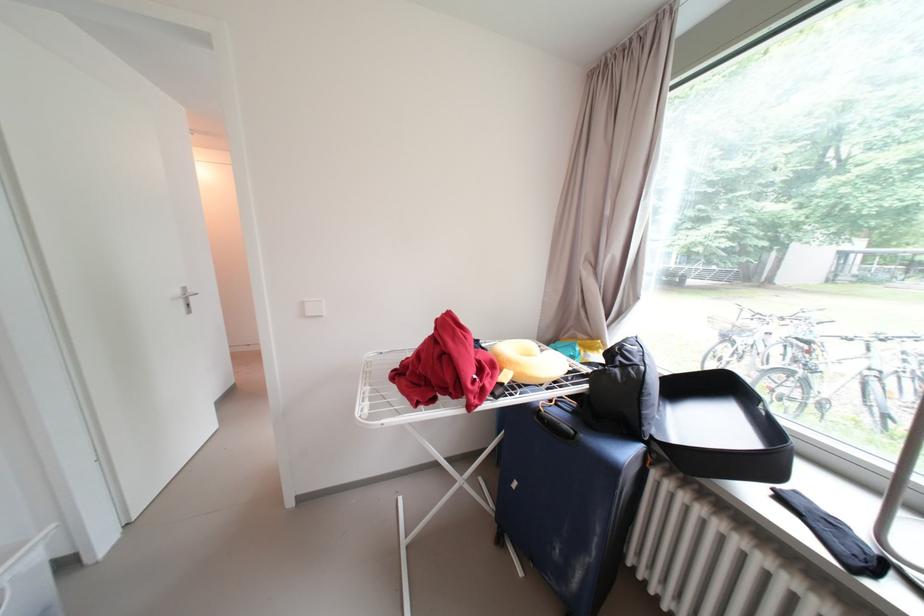
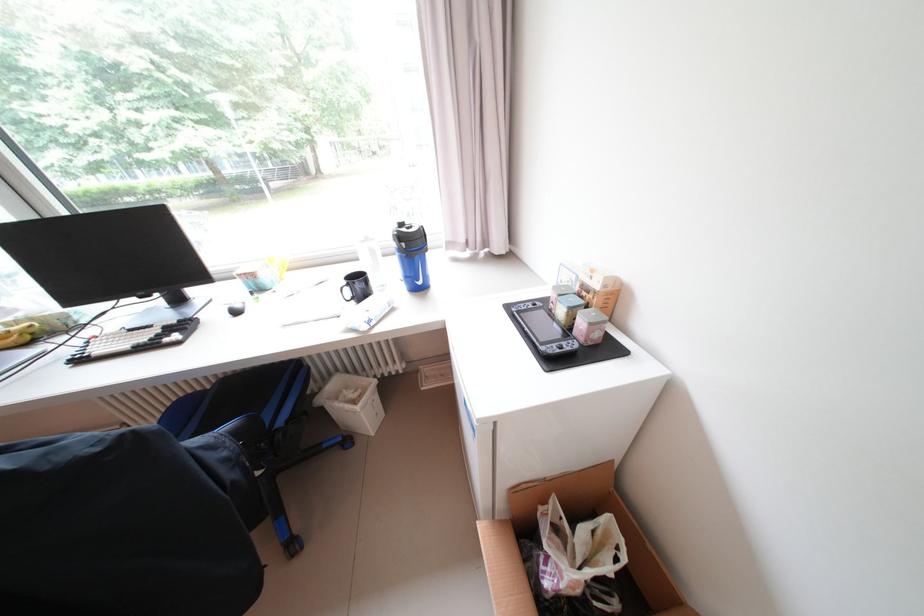
Question: I am providing you with two images of the same scene from different viewpoints. Which of the following objects are not visible in image2?

Choices:
 (A) small green clock
 (B) small cardboard box
 (C) yellow banana
 (D) suitcase handle

Answer: (D)